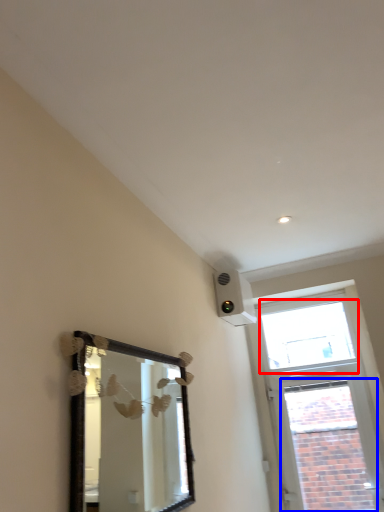
Question: Which object appears closest to the camera in this image, window (highlighted by a red box) or window (highlighted by a blue box)?

Choices:
 (A) window
 (B) window

Answer: (B)